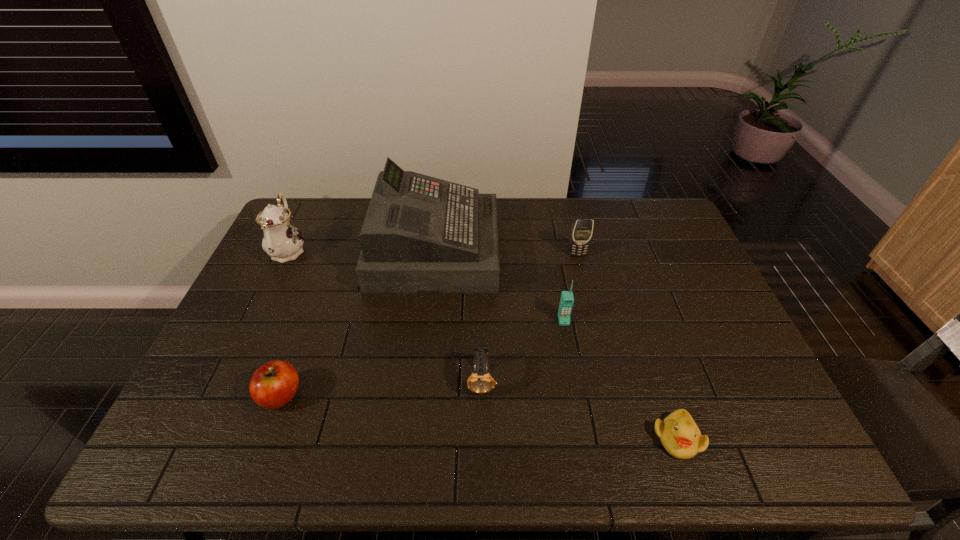
What are the coordinates of `the tallest object` in the screenshot? It's located at (421, 234).

At what (x,y) coordinates should I click in order to perform the action: click on the sixth shortest object. Please return your answer as a coordinate pair (x, y). The image size is (960, 540). Looking at the image, I should click on click(282, 241).

You are a GUI agent. You are given a task and a screenshot of the screen. Output one action in this format:
    pyautogui.click(x=<x>, y=<y>)
    Task: Click on the chinaware
    The width and height of the screenshot is (960, 540).
    Given the screenshot: What is the action you would take?
    pyautogui.click(x=282, y=241)

Identify the location of the farther cellular telephone. (582, 229).

This screenshot has height=540, width=960. I want to click on the sixth object from left to right, so click(582, 229).

Find the location of `the third object from right to left`. the third object from right to left is located at coordinates (567, 299).

You are a GUI agent. You are given a task and a screenshot of the screen. Output one action in this format:
    pyautogui.click(x=<x>, y=<y>)
    Task: Click on the left cellular telephone
    
    Given the screenshot: What is the action you would take?
    pyautogui.click(x=567, y=299)

This screenshot has width=960, height=540. I want to click on watch, so click(480, 381).

At what (x,y) coordinates should I click in order to perform the action: click on the sixth object from right to left. Please return your answer as a coordinate pair (x, y). This screenshot has width=960, height=540. Looking at the image, I should click on [275, 383].

Identify the location of the shortest object. The height and width of the screenshot is (540, 960). (680, 436).